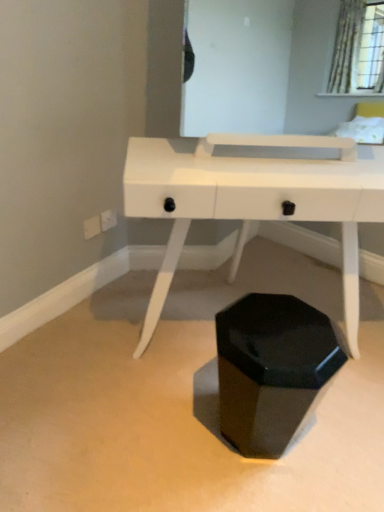
Question: From the image's perspective, is black glossy hexagonal at center located above white glossy desk at center?

Choices:
 (A) no
 (B) yes

Answer: (A)

Question: Can you confirm if black glossy hexagonal at center is shorter than white glossy desk at center?

Choices:
 (A) yes
 (B) no

Answer: (A)

Question: Is black glossy hexagonal at center positioned before white glossy desk at center?

Choices:
 (A) yes
 (B) no

Answer: (A)

Question: Can you confirm if black glossy hexagonal at center is taller than white glossy desk at center?

Choices:
 (A) no
 (B) yes

Answer: (A)

Question: Are black glossy hexagonal at center and white glossy desk at center making contact?

Choices:
 (A) no
 (B) yes

Answer: (A)

Question: Is black glossy hexagonal at center positioned far away from white glossy desk at center?

Choices:
 (A) yes
 (B) no

Answer: (B)

Question: Is white glossy desk at center outside black glossy hexagonal at center?

Choices:
 (A) no
 (B) yes

Answer: (B)

Question: Are white glossy desk at center and black glossy hexagonal at center beside each other?

Choices:
 (A) no
 (B) yes

Answer: (A)

Question: Considering the relative sizes of white glossy desk at center and black glossy hexagonal at center in the image provided, is white glossy desk at center bigger than black glossy hexagonal at center?

Choices:
 (A) no
 (B) yes

Answer: (B)

Question: Does white glossy desk at center appear on the right side of black glossy hexagonal at center?

Choices:
 (A) yes
 (B) no

Answer: (A)

Question: From a real-world perspective, is white glossy desk at center on top of black glossy hexagonal at center?

Choices:
 (A) no
 (B) yes

Answer: (B)

Question: Does white glossy desk at center have a lesser height compared to black glossy hexagonal at center?

Choices:
 (A) yes
 (B) no

Answer: (B)

Question: In the image, is white glossy desk at center positioned in front of or behind black glossy hexagonal at center?

Choices:
 (A) behind
 (B) front

Answer: (A)